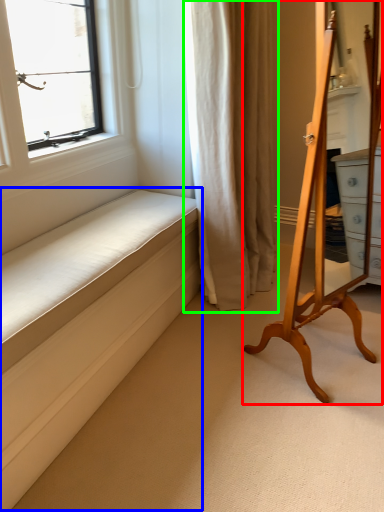
Question: Based on their relative distances, which object is farther from furniture (highlighted by a red box)? Choose from bed frame (highlighted by a blue box) and curtain (highlighted by a green box).

Choices:
 (A) bed frame
 (B) curtain

Answer: (A)